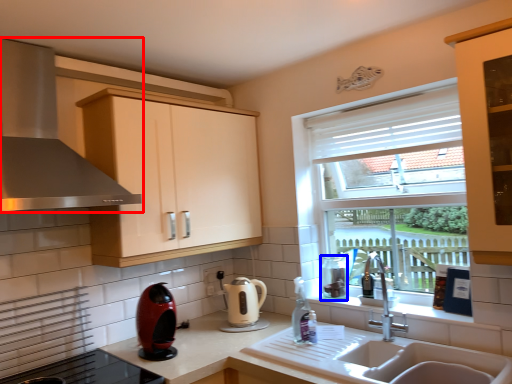
Question: Which object is further to the camera taking this photo, home appliance (highlighted by a red box) or appliance (highlighted by a blue box)?

Choices:
 (A) home appliance
 (B) appliance

Answer: (B)